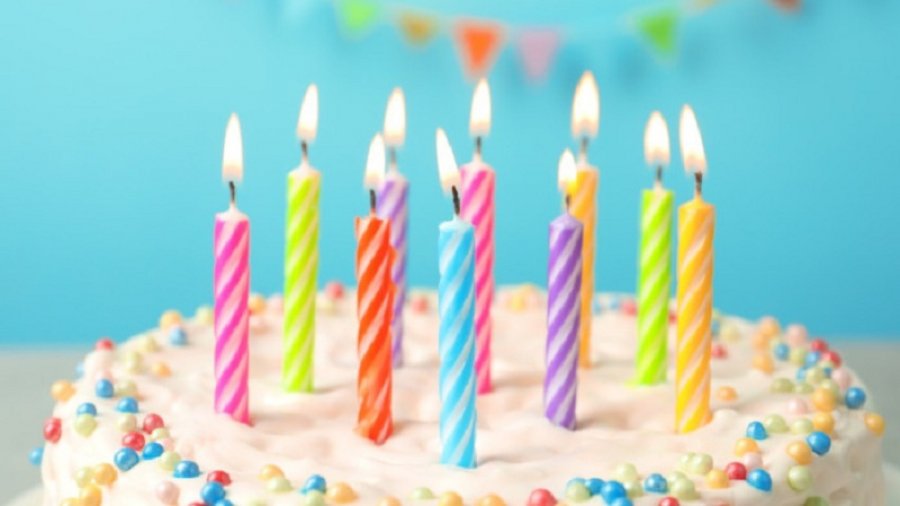
This screenshot has width=900, height=506. I want to click on pink, green, orange, purple, blue and yellow birthday candles, so click(x=702, y=292), click(x=663, y=239), click(x=579, y=199), click(x=573, y=274), click(x=469, y=215), click(x=454, y=272), click(x=385, y=199), click(x=373, y=275), click(x=299, y=230), click(x=227, y=292).